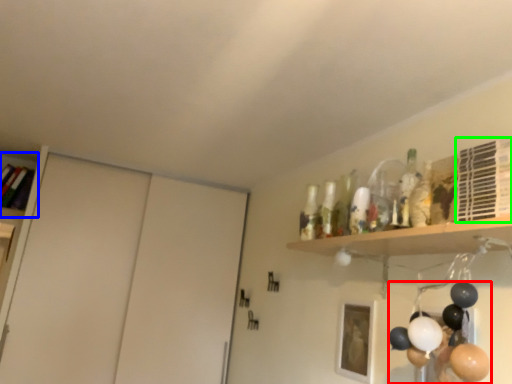
Question: Which object is positioned farthest from balloon (highlighted by a red box)? Select from shelf (highlighted by a blue box) and shelf (highlighted by a green box).

Choices:
 (A) shelf
 (B) shelf

Answer: (A)